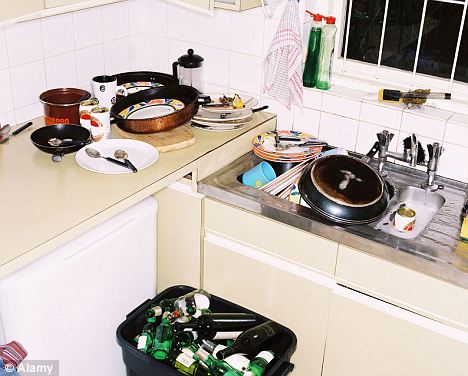
Where is `dishes`? dishes is located at coordinates (257, 167), (269, 142).